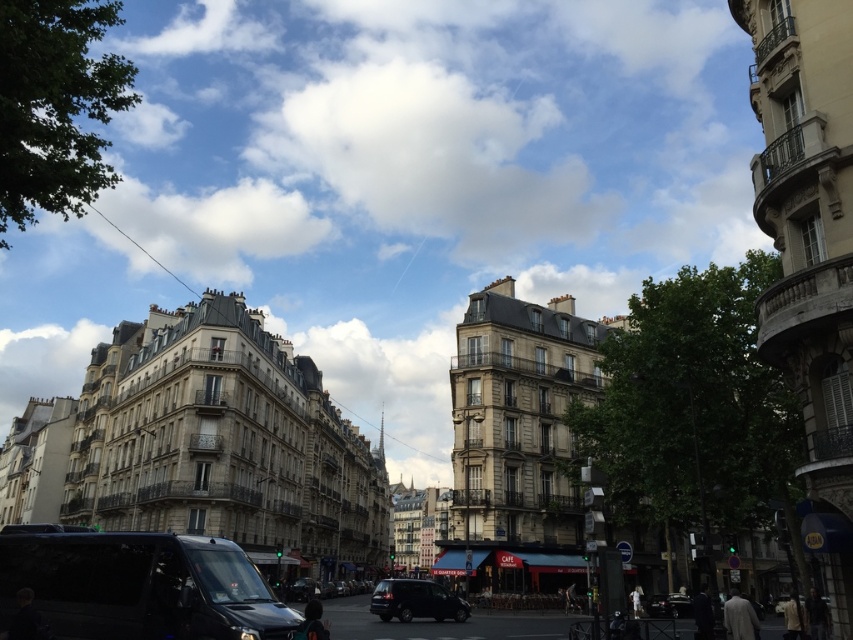
You are standing at the starting point and need to reach the destination. The starting point is point (x=90, y=624) and the destination is point (x=370, y=611). Based on the scene, can you determine if the starting point is closer to you than the destination?

Point (x=90, y=624) is in front of point (x=370, y=611), so the starting point is closer to you than the destination.

You are a pedestrian standing on the sidewalk and want to cross the street to reach the black van parked on the left. However, there is a shiny black suv at center and a shiny black car at lower right in your path. Which vehicle should you move around to safely reach the black van?

You should move around the shiny black car at lower right because the shiny black suv at center is positioned to its left, blocking the direct path to the black van. By going around the shiny black car at lower right, you can navigate around the suv and reach the van.